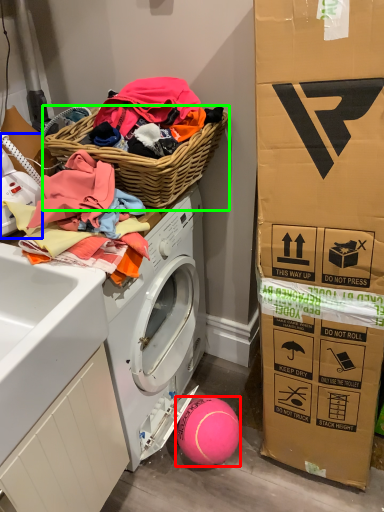
Question: Which object is the closest to the ball (highlighted by a red box)? Choose among these: washer (highlighted by a blue box) or picnic basket (highlighted by a green box).

Choices:
 (A) washer
 (B) picnic basket

Answer: (B)